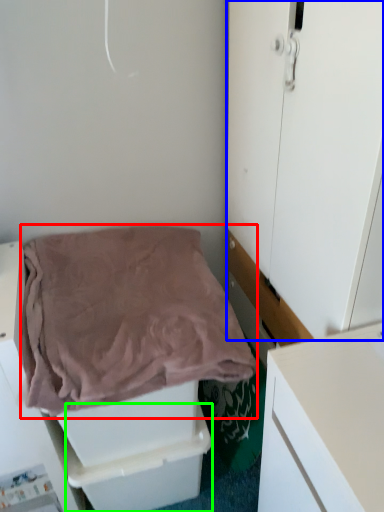
Question: Estimate the real-world distances between objects in this image. Which object is farther from blanket (highlighted by a red box), door (highlighted by a blue box) or drawer (highlighted by a green box)?

Choices:
 (A) door
 (B) drawer

Answer: (B)